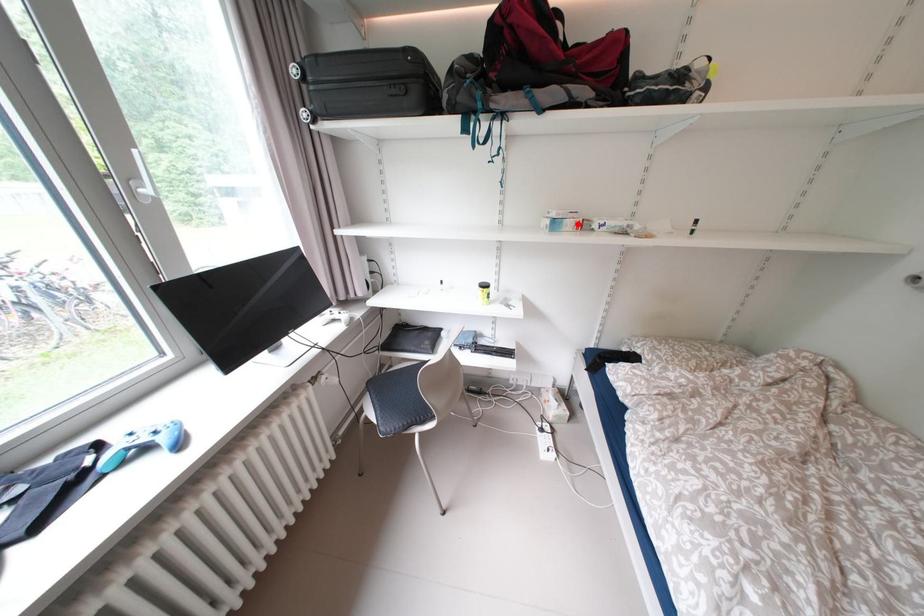
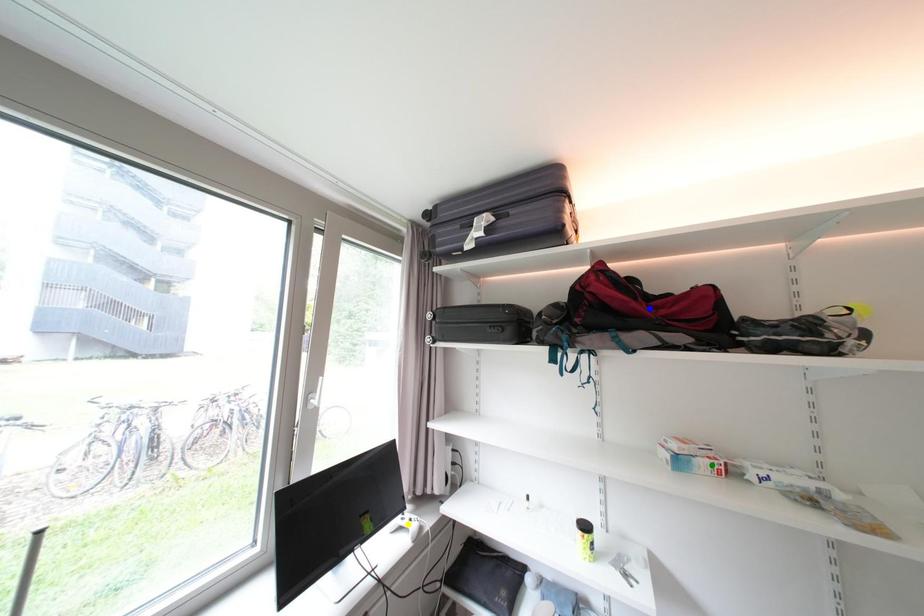
Question: I am providing you with two images of the same scene from different viewpoints. A red point is marked on the first image. You are given multiple points on the second image. Which point in image 2 represents the same 3d spot as the red point in image 1?

Choices:
 (A) blue point
 (B) yellow point
 (C) green point

Answer: (C)